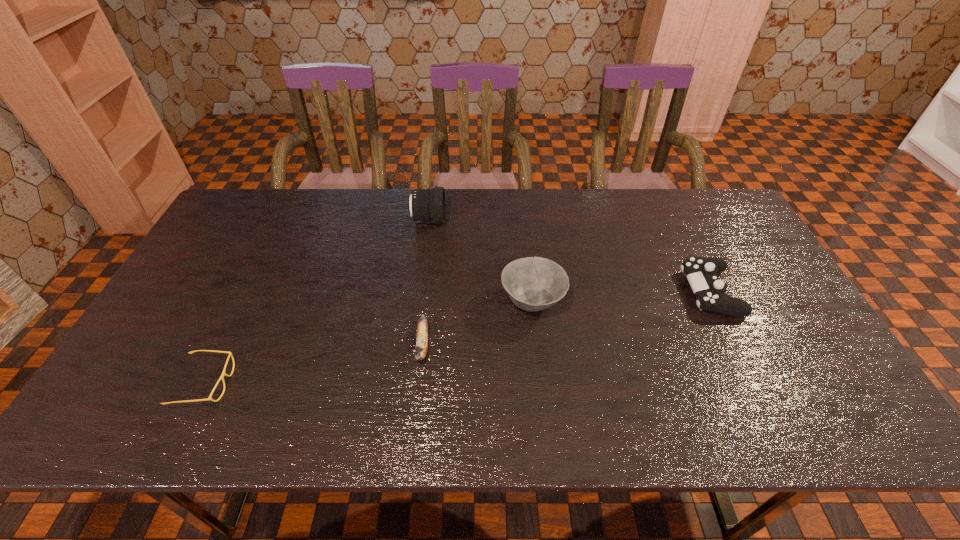
Locate an element on the screen. This screenshot has height=540, width=960. vacant region between the second tallest object and the control is located at coordinates (621, 296).

Where is `free spot between the control and the leftmost object`? The width and height of the screenshot is (960, 540). free spot between the control and the leftmost object is located at coordinates 458,338.

Where is `vacant area between the tallest object and the leftmost object`? The height and width of the screenshot is (540, 960). vacant area between the tallest object and the leftmost object is located at coordinates (317, 301).

At what (x,y) coordinates should I click in order to perform the action: click on free spot between the rightmost object and the shortest object. Please return your answer as a coordinate pair (x, y). Looking at the image, I should click on (458, 338).

I want to click on free space between the farthest object and the control, so click(569, 256).

You are a GUI agent. You are given a task and a screenshot of the screen. Output one action in this format:
    pyautogui.click(x=<x>, y=<y>)
    Task: Click on the free space between the farthest object and the rightmost object
    
    Given the screenshot: What is the action you would take?
    pyautogui.click(x=569, y=256)

Locate which object ranks fourth in proximity to the farthest object. Please provide its 2D coordinates. Your answer should be formatted as a tuple, i.e. [(x, y)], where the tuple contains the x and y coordinates of a point satisfying the conditions above.

[(701, 272)]

Select which object appears as the third closest to the control. Please provide its 2D coordinates. Your answer should be formatted as a tuple, i.e. [(x, y)], where the tuple contains the x and y coordinates of a point satisfying the conditions above.

[(428, 205)]

Find the location of a particular element. The width and height of the screenshot is (960, 540). vacant region that satisfies the following two spatial constraints: 1. on the front side of the fourth object from left to right; 2. in front of the lenses of the leftmost object is located at coordinates (541, 383).

Where is `free space that satisfies the following two spatial constraints: 1. at the front element of the tallest object; 2. on the left side of the second object from right to left`? The height and width of the screenshot is (540, 960). free space that satisfies the following two spatial constraints: 1. at the front element of the tallest object; 2. on the left side of the second object from right to left is located at coordinates (418, 301).